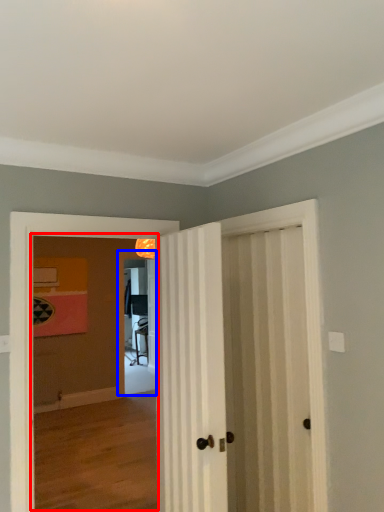
Question: Which object appears farthest to the camera in this image, corridor (highlighted by a red box) or screen door (highlighted by a blue box)?

Choices:
 (A) corridor
 (B) screen door

Answer: (B)